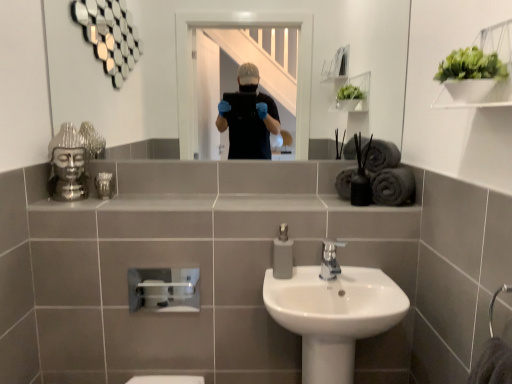
Question: Is dark gray matte bath towel at right, the second bath towel when ordered from top to bottom, to the right of matte gray soap dispenser at center from the viewer's perspective?

Choices:
 (A) yes
 (B) no

Answer: (A)

Question: Considering the relative sizes of dark gray matte bath towel at right, which is counted as the 1th bath towel, starting from the bottom, and matte gray soap dispenser at center in the image provided, is dark gray matte bath towel at right, which is counted as the 1th bath towel, starting from the bottom, bigger than matte gray soap dispenser at center?

Choices:
 (A) yes
 (B) no

Answer: (A)

Question: Is dark gray matte bath towel at right, which is counted as the 1th bath towel, starting from the bottom, wider than matte gray soap dispenser at center?

Choices:
 (A) yes
 (B) no

Answer: (A)

Question: Is dark gray matte bath towel at right, which is counted as the 1th bath towel, starting from the bottom, not inside matte gray soap dispenser at center?

Choices:
 (A) no
 (B) yes

Answer: (B)

Question: Does dark gray matte bath towel at right, which is counted as the 1th bath towel, starting from the bottom, have a lesser width compared to matte gray soap dispenser at center?

Choices:
 (A) yes
 (B) no

Answer: (B)

Question: From a real-world perspective, is dark gray matte bath towel at right, the second bath towel when ordered from top to bottom, over matte gray soap dispenser at center?

Choices:
 (A) yes
 (B) no

Answer: (A)

Question: Can you confirm if dark gray matte bath towel at right, which is counted as the 1th bath towel, starting from the bottom, is thinner than gray matte towel at upper right, the 1th bath towel positioned from the top?

Choices:
 (A) yes
 (B) no

Answer: (A)

Question: Could gray matte towel at upper right, the 1th bath towel positioned from the top, be considered to be inside dark gray matte bath towel at right, which is counted as the 1th bath towel, starting from the bottom?

Choices:
 (A) no
 (B) yes

Answer: (A)

Question: From a real-world perspective, is dark gray matte bath towel at right, which is counted as the 1th bath towel, starting from the bottom, located higher than gray matte towel at upper right, the 1th bath towel positioned from the top?

Choices:
 (A) no
 (B) yes

Answer: (A)

Question: Is dark gray matte bath towel at right, the second bath towel when ordered from top to bottom, next to gray matte towel at upper right, which is the second bath towel in bottom-to-top order, and touching it?

Choices:
 (A) yes
 (B) no

Answer: (A)

Question: Is dark gray matte bath towel at right, which is counted as the 1th bath towel, starting from the bottom, behind gray matte towel at upper right, which is the second bath towel in bottom-to-top order?

Choices:
 (A) no
 (B) yes

Answer: (A)

Question: From the image's perspective, is dark gray matte bath towel at right, the second bath towel when ordered from top to bottom, on top of gray matte towel at upper right, the 1th bath towel positioned from the top?

Choices:
 (A) yes
 (B) no

Answer: (B)

Question: Does metallic glass at upper left come behind white glossy sink at center?

Choices:
 (A) yes
 (B) no

Answer: (A)